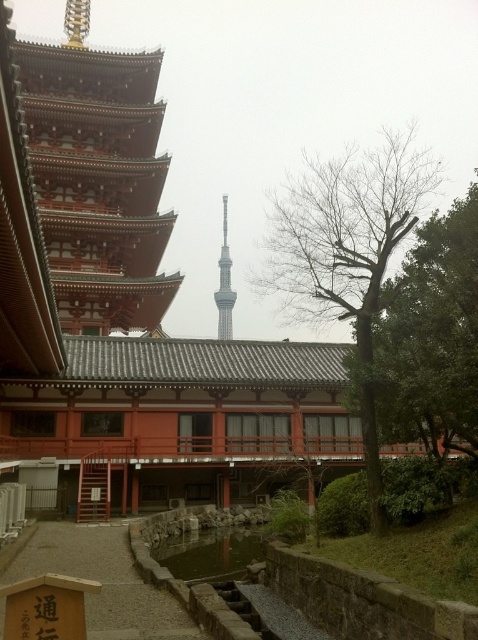
You are a tourist holding a camera and want to capture both the wooden sign at lower left and the smooth glass tower at center in a single photo. Considering their sizes, which object should you position closer to the camera to ensure both are visible in the frame?

Since the wooden sign at lower left is wider than the smooth glass tower at center, you should position the wooden sign at lower left closer to the camera to ensure both fit within the frame.

You are a tourist holding a map and looking at the wooden sign at lower left and the smooth glass tower at center. According to the map, you need to walk towards the closest object to reach the Tokyo Skytree. Which object should you walk towards?

The wooden sign at lower left is in front of smooth glass tower at center, so the wooden sign at lower left is closer to you. Therefore, you should walk towards the wooden sign at lower left to reach the Tokyo Skytree first.